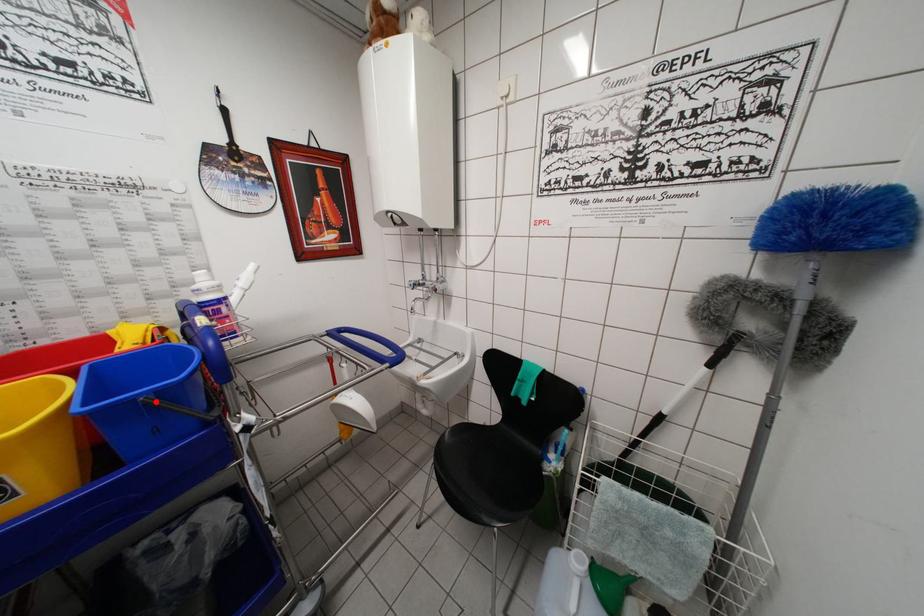
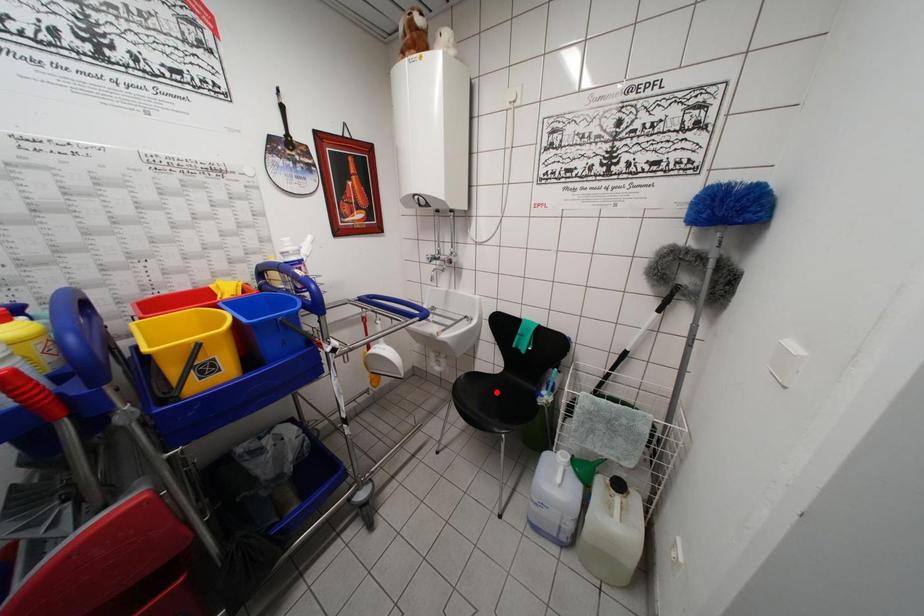
I am providing you with two images of the same scene from different viewpoints. A red point is marked on the first image and another point is marked on the second image. Is the red point in image1 aligned with the point shown in image2?

No